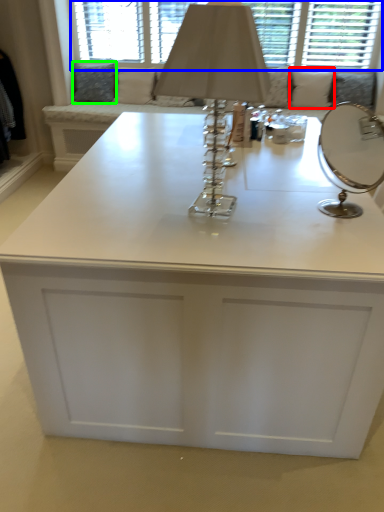
Question: Which object is positioned farthest from pillow (highlighted by a red box)? Select from bay window (highlighted by a blue box) and pillow (highlighted by a green box).

Choices:
 (A) bay window
 (B) pillow

Answer: (B)